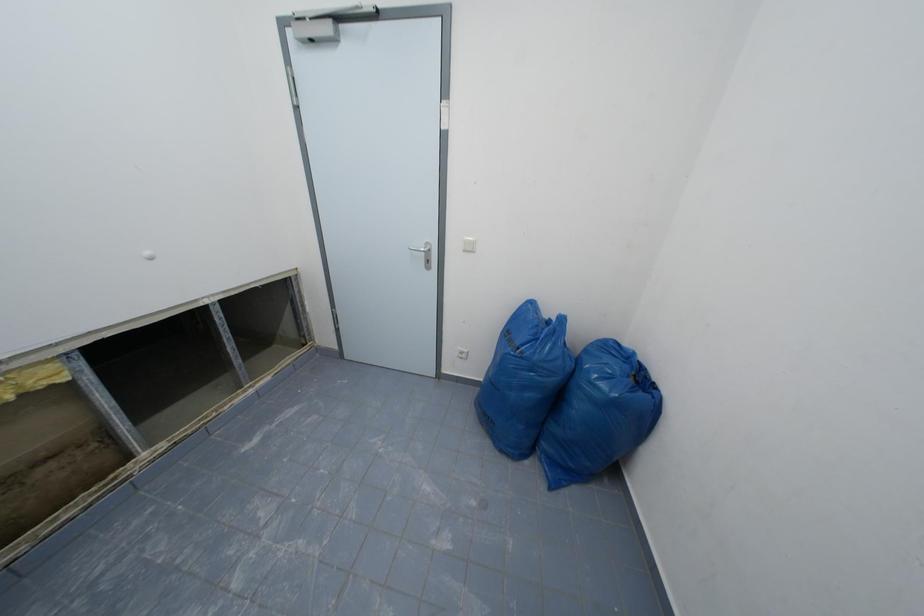
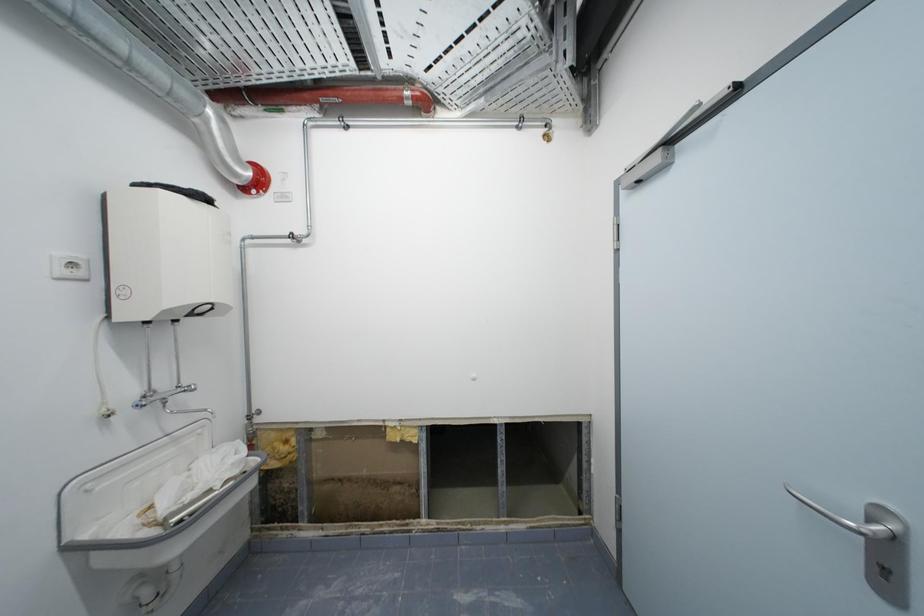
Question: The camera is either moving clockwise (left) or counter-clockwise (right) around the object. The first image is from the beginning of the video and the second image is from the end. Is the camera moving left or right when shooting the video?

Choices:
 (A) Left
 (B) Right

Answer: (B)